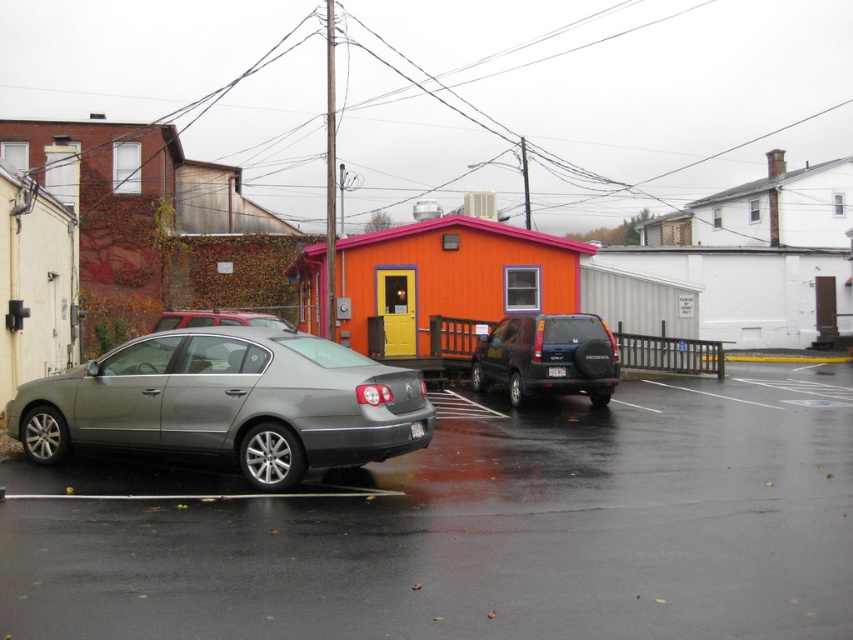
You are a delivery driver who needs to park your van in the parking lot. The parking lot has a gray sedan parked diagonally and a white matte building at upper right. According to the parking rules, vehicles must stay at least 2 meters away from any building. Can you safely park your van here?

The white matte building at upper right is located at coordinates point (734, 262). Since the parking rules require vehicles to stay at least 2 meters away from buildings, you need to ensure your van maintains this distance from the white matte building at upper right. However, without knowing the exact dimensions of the parking space and the van, it is impossible to determine if the distance requirement is met. Please check the parking area measurements before deciding.